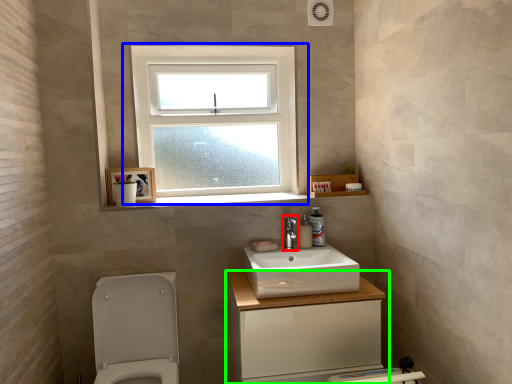
Question: Which object is the closest to the tap (highlighted by a red box)? Choose among these: window (highlighted by a blue box) or bathroom cabinet (highlighted by a green box).

Choices:
 (A) window
 (B) bathroom cabinet

Answer: (B)